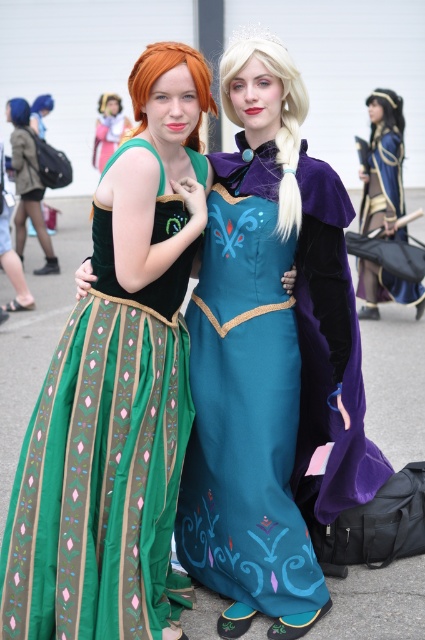
You are a photographer standing in front of the two dressed individuals. You need to take a photo that focuses on the green satin dress at left while ensuring the matte green dress at center is still visible in the background. Can you position yourself in a way that both are in frame without moving either dress?

Yes, since the green satin dress at left is closer to the viewer than the matte green dress at center, you can position yourself so that the green satin dress at left is in the foreground and the matte green dress at center is visible in the background of the photo.

You are a photographer at a cosplay event and need to adjust the lighting so that the teal satin dress at center is fully visible without the velvet blue cape at center blocking it. What adjustment should you make?

The teal satin dress at center is in front of the velvet blue cape at center, so you should position the lighting to highlight the front of the teal satin dress at center while ensuring the velvet blue cape at center is not casting a shadow over it.